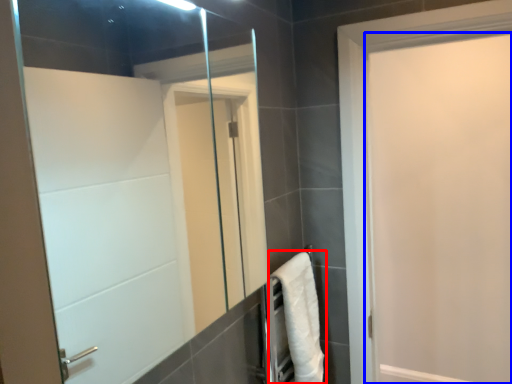
Question: Which point is further to the camera, bath towel (highlighted by a red box) or door (highlighted by a blue box)?

Choices:
 (A) bath towel
 (B) door

Answer: (A)